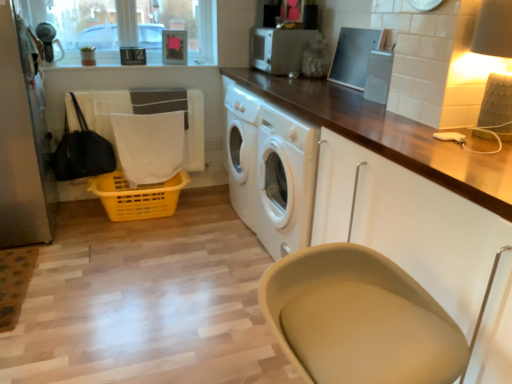
Question: From the image's perspective, is clear glass window screen at upper left located beneath white fabric at lower left?

Choices:
 (A) yes
 (B) no

Answer: (B)

Question: Is clear glass window screen at upper left facing away from white fabric at lower left?

Choices:
 (A) no
 (B) yes

Answer: (A)

Question: Does clear glass window screen at upper left lie in front of white fabric at lower left?

Choices:
 (A) no
 (B) yes

Answer: (B)

Question: Can you confirm if clear glass window screen at upper left is smaller than white fabric at lower left?

Choices:
 (A) no
 (B) yes

Answer: (A)

Question: Is clear glass window screen at upper left touching white fabric at lower left?

Choices:
 (A) no
 (B) yes

Answer: (A)

Question: Is clear glass window screen at upper left wider than white fabric at lower left?

Choices:
 (A) yes
 (B) no

Answer: (A)

Question: From the image's perspective, is clear plastic container at upper center, which is the 1th appliance from front to back, over yellow plastic basket at lower left?

Choices:
 (A) yes
 (B) no

Answer: (A)

Question: Considering the relative sizes of clear plastic container at upper center, marked as the 2th appliance in a back-to-front arrangement, and yellow plastic basket at lower left in the image provided, is clear plastic container at upper center, marked as the 2th appliance in a back-to-front arrangement, taller than yellow plastic basket at lower left?

Choices:
 (A) yes
 (B) no

Answer: (B)

Question: Is clear plastic container at upper center, the first appliance in the bottom-to-top sequence, oriented away from yellow plastic basket at lower left?

Choices:
 (A) yes
 (B) no

Answer: (B)

Question: Is clear plastic container at upper center, the second appliance in the left-to-right sequence, in contact with yellow plastic basket at lower left?

Choices:
 (A) no
 (B) yes

Answer: (A)

Question: Is clear plastic container at upper center, marked as the 2th appliance in a back-to-front arrangement, bigger than yellow plastic basket at lower left?

Choices:
 (A) yes
 (B) no

Answer: (B)

Question: Is clear plastic container at upper center, marked as the 2th appliance in a back-to-front arrangement, facing towards yellow plastic basket at lower left?

Choices:
 (A) no
 (B) yes

Answer: (A)

Question: Is clear glass window screen at upper left at the right side of matte cream lampshade at upper right?

Choices:
 (A) yes
 (B) no

Answer: (B)